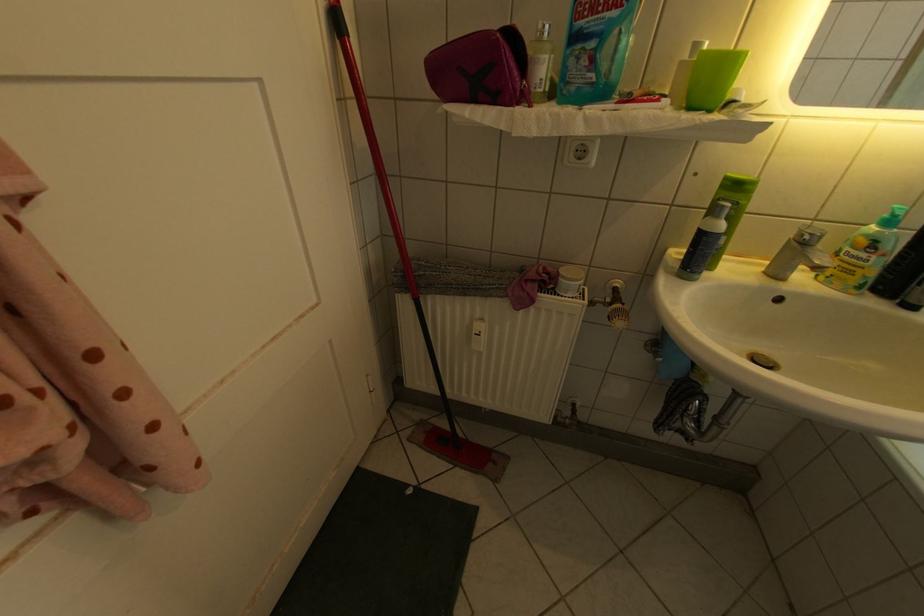
Find where to unscrew the white jar lid. Please return your answer as a coordinate pair (x, y).

(569, 281)